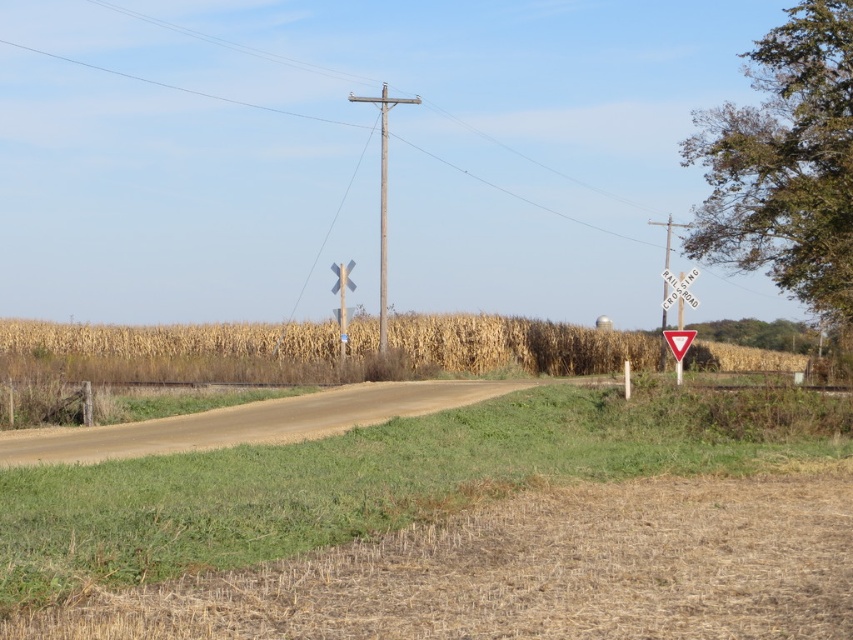
Who is positioned more to the left, green grass at center or metallic pole at right?

green grass at center

Does green grass at center have a lesser height compared to metallic pole at right?

Yes.

This screenshot has width=853, height=640. I want to click on green grass at center, so click(x=456, y=528).

Between golden dry corn at center and weathered wood telegraph pole at center, which one is positioned lower?

golden dry corn at center

Does golden dry corn at center come behind weathered wood telegraph pole at center?

No, it is not.

The height and width of the screenshot is (640, 853). Describe the element at coordinates (167, 348) in the screenshot. I see `golden dry corn at center` at that location.

At what (x,y) coordinates should I click in order to perform the action: click on golden dry corn at center. Please return your answer as a coordinate pair (x, y). Looking at the image, I should click on (167, 348).

Which is in front, point (531, 321) or point (669, 248)?

Point (531, 321) is more forward.

The height and width of the screenshot is (640, 853). Find the location of `golden dry corn at center`. golden dry corn at center is located at coordinates (167, 348).